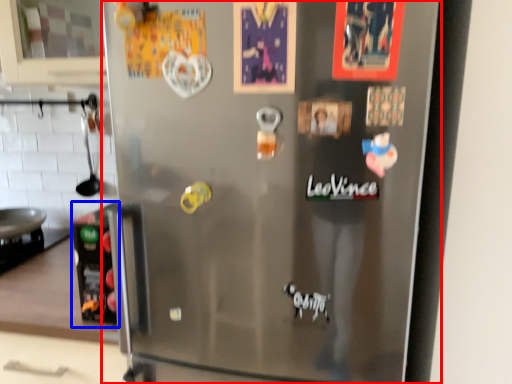
Question: Among these objects, which one is nearest to the camera, refrigerator (highlighted by a red box) or appliance (highlighted by a blue box)?

Choices:
 (A) refrigerator
 (B) appliance

Answer: (A)